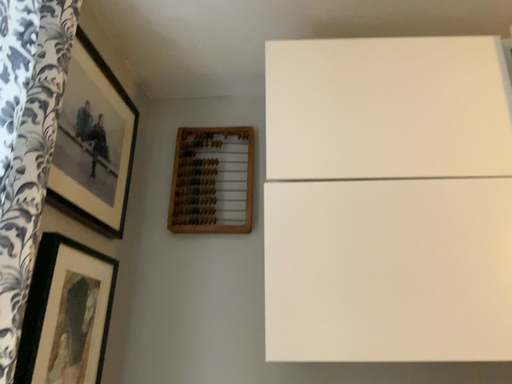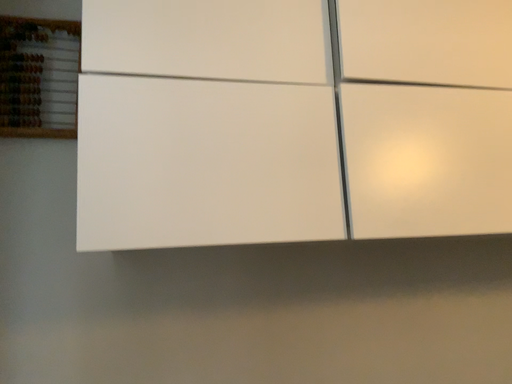
Question: How did the camera likely rotate when shooting the video?

Choices:
 (A) rotated right
 (B) rotated left

Answer: (A)